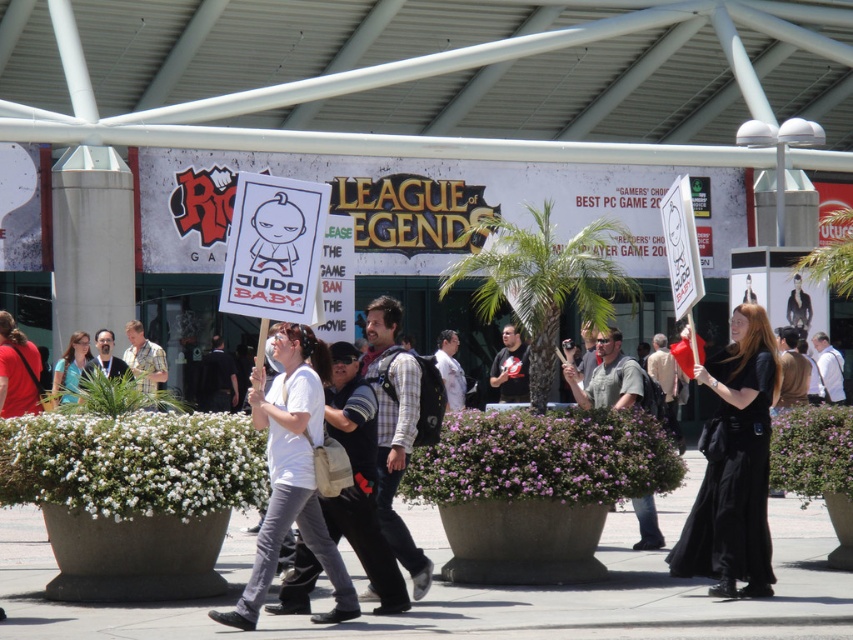
You are a attendee at the gaming convention and you want to find the banner for League of Legends. You are currently standing at the dark gray backpack at center. Which direction should you walk to reach the banner?

The banner for League of Legends is in the background of the scene. Since you are at the dark gray backpack at center, you should walk towards the background direction to reach the banner.